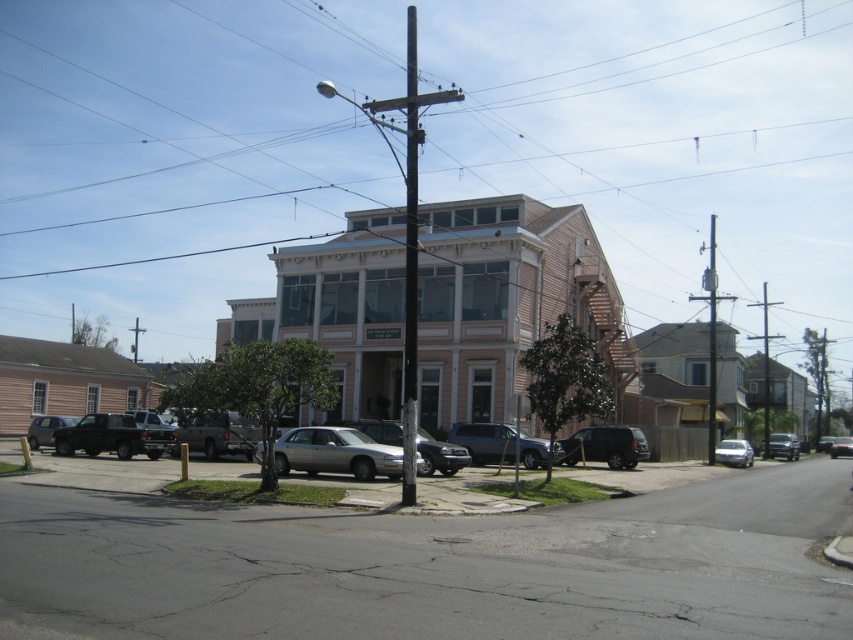
Question: Which point is farther to the camera?

Choices:
 (A) metallic silver car at center
 (B) silver metallic sedan at center

Answer: (A)

Question: Which point appears farthest from the camera in this image?

Choices:
 (A) (843, 436)
 (B) (556, 444)
 (C) (416, 291)

Answer: (A)

Question: Does black metallic pole at center have a lesser width compared to satin silver sedan at center-right?

Choices:
 (A) yes
 (B) no

Answer: (B)

Question: Can you confirm if satin black suv at center is bigger than metallic gray telegraph pole at right?

Choices:
 (A) yes
 (B) no

Answer: (B)

Question: Does black metallic pole at center appear on the left side of satin black suv at center?

Choices:
 (A) no
 (B) yes

Answer: (B)

Question: Among these points, which one is nearest to the camera?

Choices:
 (A) (451, 445)
 (B) (315, 472)
 (C) (410, 481)

Answer: (C)